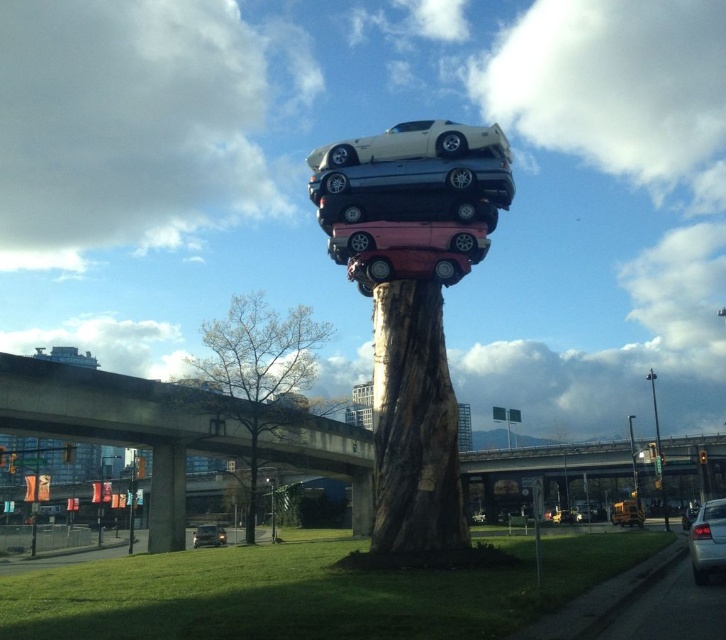
Question: Which point is farther from the camera taking this photo?

Choices:
 (A) (335, 179)
 (B) (309, 426)
 (C) (311, 161)
 (D) (425, 401)

Answer: (B)

Question: Among these points, which one is farthest from the camera?

Choices:
 (A) (460, 176)
 (B) (60, 410)

Answer: (B)

Question: Does brown wood tree trunk at center have a greater width compared to matte black sedan at lower right?

Choices:
 (A) yes
 (B) no

Answer: (A)

Question: Is metallic silver car at center in front of metallic red car at center?

Choices:
 (A) no
 (B) yes

Answer: (B)

Question: Which of the following is the closest to the observer?

Choices:
 (A) (719, 504)
 (B) (431, 129)
 (C) (425, 369)
 (D) (473, 163)

Answer: (A)

Question: Can you confirm if bare wood tree at center is positioned above metallic pole at center-right?

Choices:
 (A) no
 (B) yes

Answer: (B)